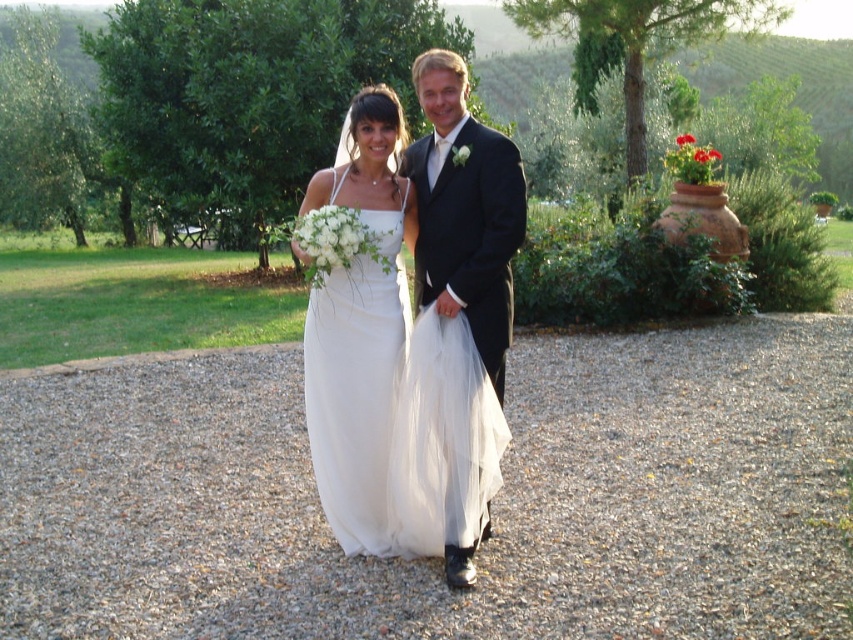
You are a photographer at this wedding scene. You need to position a backdrop behind the couple to ensure both the white tulle dress at center and the black satin suit at center are fully visible. Given their sizes, which one might require more space behind them?

The white tulle dress at center is larger in size than the black satin suit at center, so it would require more space behind them to ensure it is fully visible.